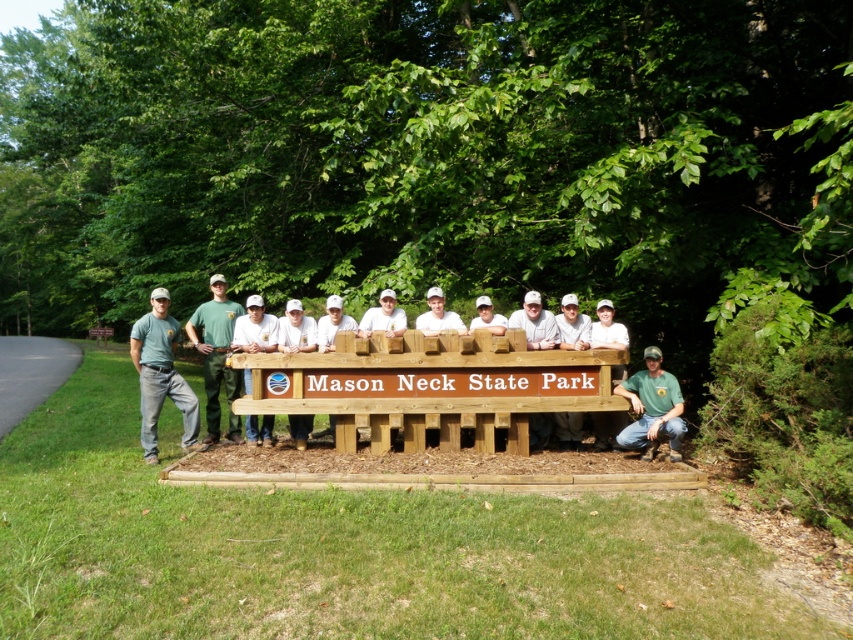
You are organizing a photo shoot and need to determine the best position for a spotlight. Given the scene at Mason Neck State Park with the wooden signboard and the group, which object between the matte green shirt at left and the green uniform at center should the spotlight be placed closer to if you want to highlight the larger area?

The spotlight should be placed closer to the green uniform at center because it occupies more space than the matte green shirt at left.

You are a photographer at Mason Neck State Park and need to position a new sign to the right of the matte green shirt at left. Where should you place the new sign in terms of coordinates?

The new sign should be placed to the right of the matte green shirt at left, which is located at coordinates point [161,376]. Therefore, the new sign should be positioned at a coordinate with an x value greater than 0.588 and the same y value of 0.190.